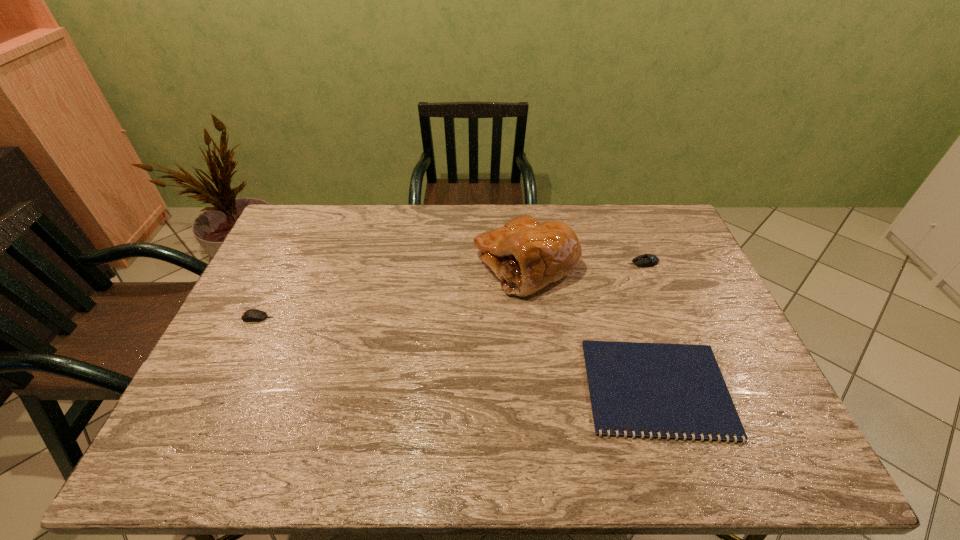
Identify the location of vacant area at the left edge. The width and height of the screenshot is (960, 540). (303, 275).

Locate an element on the screen. Image resolution: width=960 pixels, height=540 pixels. vacant area at the right edge is located at coordinates (719, 316).

Locate an element on the screen. vacant region at the far left corner of the desktop is located at coordinates (322, 217).

You are a GUI agent. You are given a task and a screenshot of the screen. Output one action in this format:
    pyautogui.click(x=<x>, y=<y>)
    Task: Click on the free spot between the farther computer mouse and the second shortest object
    The width and height of the screenshot is (960, 540).
    Given the screenshot: What is the action you would take?
    pyautogui.click(x=450, y=290)

Locate an element on the screen. free area in between the tallest object and the right computer mouse is located at coordinates (585, 264).

Where is `vacant space that is in between the farther computer mouse and the shorter computer mouse`? This screenshot has width=960, height=540. vacant space that is in between the farther computer mouse and the shorter computer mouse is located at coordinates (450, 290).

Where is `vacant space in between the bread and the farther computer mouse`? The height and width of the screenshot is (540, 960). vacant space in between the bread and the farther computer mouse is located at coordinates (585, 264).

Locate an element on the screen. This screenshot has height=540, width=960. free space between the shorter computer mouse and the shortest object is located at coordinates (457, 353).

I want to click on empty space that is in between the shortest object and the bread, so click(591, 327).

Locate an element on the screen. free area in between the leftmost object and the nearest object is located at coordinates (457, 353).